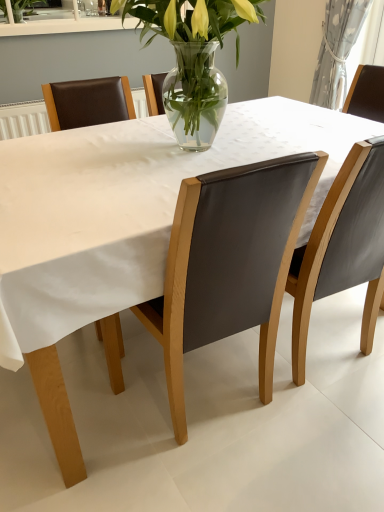
Question: Considering the relative positions of leather at center, positioned as the first chair in left-to-right order, and white textured curtain at upper right in the image provided, is leather at center, positioned as the first chair in left-to-right order, to the left of white textured curtain at upper right from the viewer's perspective?

Choices:
 (A) yes
 (B) no

Answer: (A)

Question: Is leather at center, the 2th chair viewed from the right, further to camera compared to white textured curtain at upper right?

Choices:
 (A) no
 (B) yes

Answer: (A)

Question: Does leather at center, positioned as the first chair in left-to-right order, have a lesser width compared to white textured curtain at upper right?

Choices:
 (A) no
 (B) yes

Answer: (A)

Question: From a real-world perspective, is leather at center, positioned as the first chair in left-to-right order, physically below white textured curtain at upper right?

Choices:
 (A) yes
 (B) no

Answer: (A)

Question: Is leather at center, the 2th chair viewed from the right, not inside white textured curtain at upper right?

Choices:
 (A) no
 (B) yes

Answer: (B)

Question: Is leather at center, positioned as the first chair in left-to-right order, bigger or smaller than matte gray chair at right, placed as the second chair when sorted from left to right?

Choices:
 (A) small
 (B) big

Answer: (B)

Question: Considering their positions, is leather at center, the 2th chair viewed from the right, located in front of or behind matte gray chair at right, placed as the second chair when sorted from left to right?

Choices:
 (A) behind
 (B) front

Answer: (B)

Question: From the image's perspective, is leather at center, positioned as the first chair in left-to-right order, above or below matte gray chair at right, placed as the second chair when sorted from left to right?

Choices:
 (A) below
 (B) above

Answer: (A)

Question: Looking at their shapes, would you say leather at center, the 2th chair viewed from the right, is wider or thinner than matte gray chair at right, the 1th chair in the right-to-left sequence?

Choices:
 (A) thin
 (B) wide

Answer: (A)

Question: Considering the positions of leather at center, positioned as the first chair in left-to-right order, and white textured curtain at upper right in the image, is leather at center, positioned as the first chair in left-to-right order, wider or thinner than white textured curtain at upper right?

Choices:
 (A) wide
 (B) thin

Answer: (A)

Question: Considering the positions of leather at center, positioned as the first chair in left-to-right order, and white textured curtain at upper right in the image, is leather at center, positioned as the first chair in left-to-right order, bigger or smaller than white textured curtain at upper right?

Choices:
 (A) big
 (B) small

Answer: (A)

Question: From a real-world perspective, relative to white textured curtain at upper right, is leather at center, the 2th chair viewed from the right, vertically above or below?

Choices:
 (A) below
 (B) above

Answer: (A)

Question: Considering their positions, is leather at center, positioned as the first chair in left-to-right order, located in front of or behind white textured curtain at upper right?

Choices:
 (A) behind
 (B) front

Answer: (B)

Question: Is matte gray chair at right, placed as the second chair when sorted from left to right, bigger or smaller than white textured curtain at upper right?

Choices:
 (A) big
 (B) small

Answer: (A)

Question: Considering the positions of matte gray chair at right, the 1th chair in the right-to-left sequence, and white textured curtain at upper right in the image, is matte gray chair at right, the 1th chair in the right-to-left sequence, wider or thinner than white textured curtain at upper right?

Choices:
 (A) thin
 (B) wide

Answer: (B)